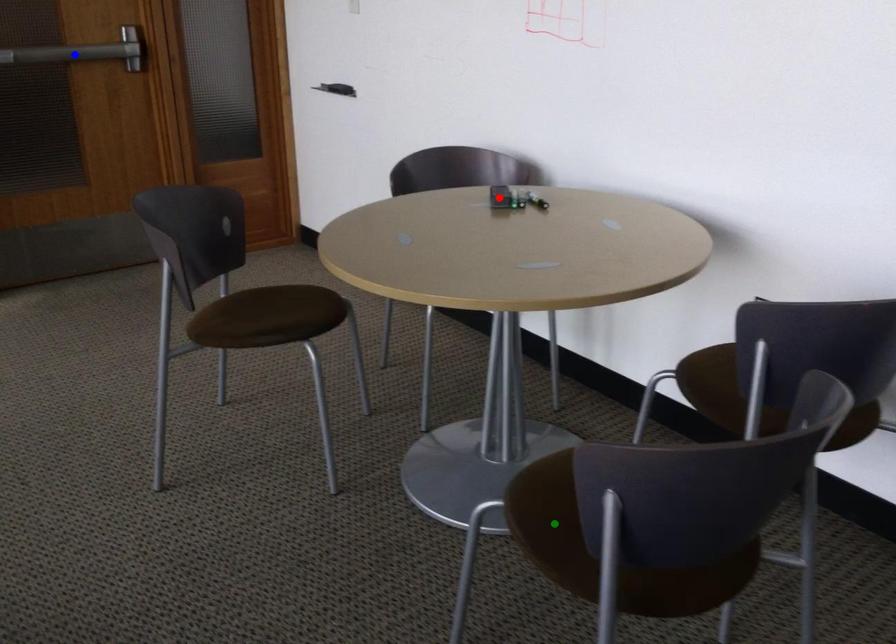
Order these from nearest to farthest:
blue point
red point
green point

blue point, red point, green point